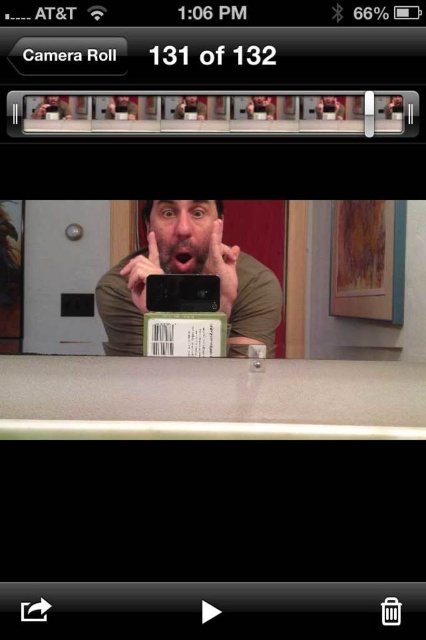
You are trying to take a photo of your phone to show off its design. You have two phones in front of you, the matte black phone at center and the black matte smartphone at center. Which one is closer to you?

The matte black phone at center is closer to you because it is in front of the black matte smartphone at center.

You are trying to figure out the arrangement of the two devices in the image. According to the scene, where is the matte black phone at center relative to the black matte smartphone at center?

The matte black phone at center is to the right of the black matte smartphone at center.